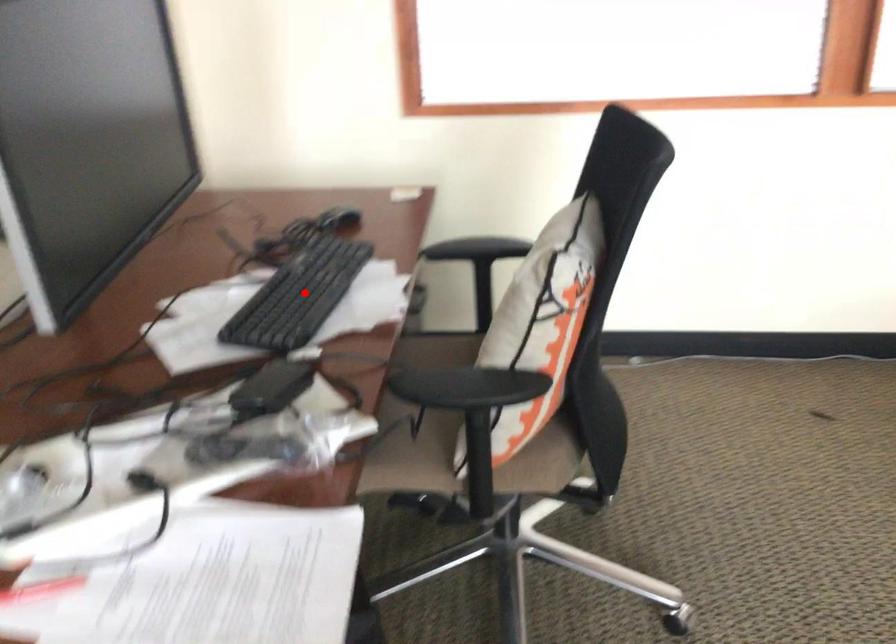
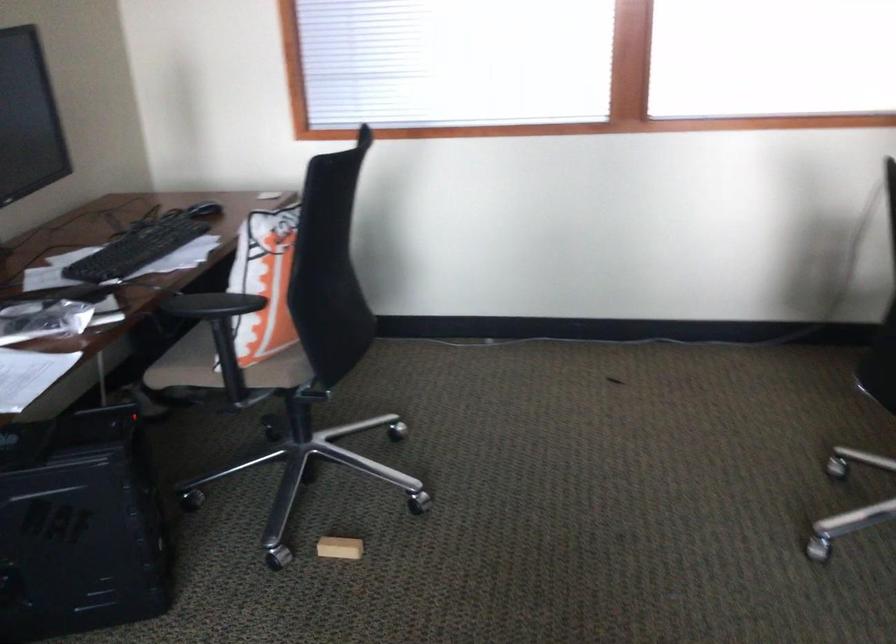
Locate, in the second image, the point that corresponds to the highlighted location in the first image.

(138, 248)